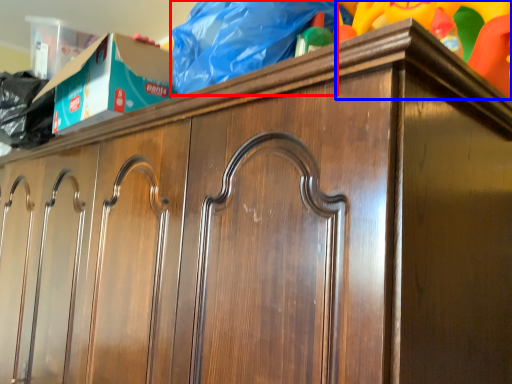
Question: Which object is further to the camera taking this photo, material (highlighted by a red box) or toy (highlighted by a blue box)?

Choices:
 (A) material
 (B) toy

Answer: (A)